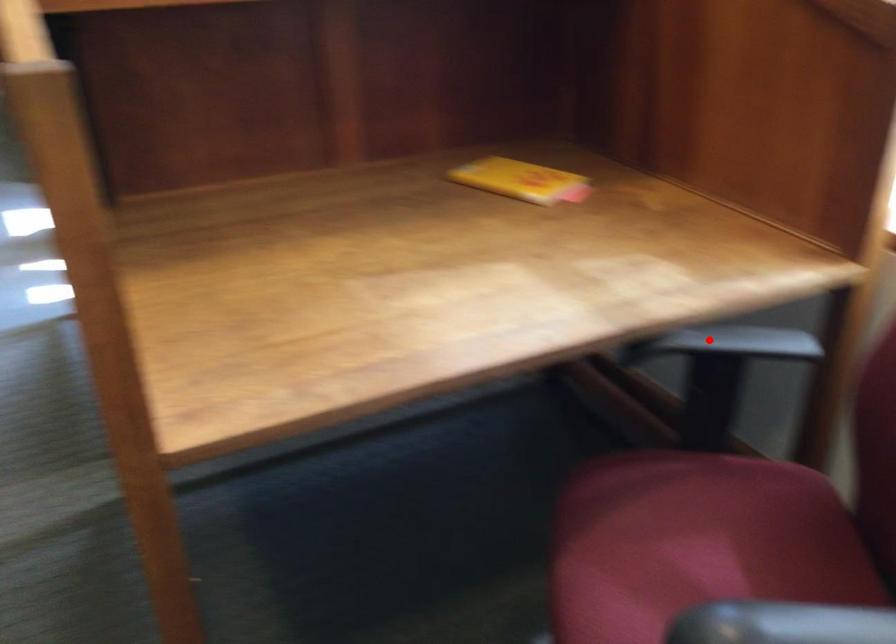
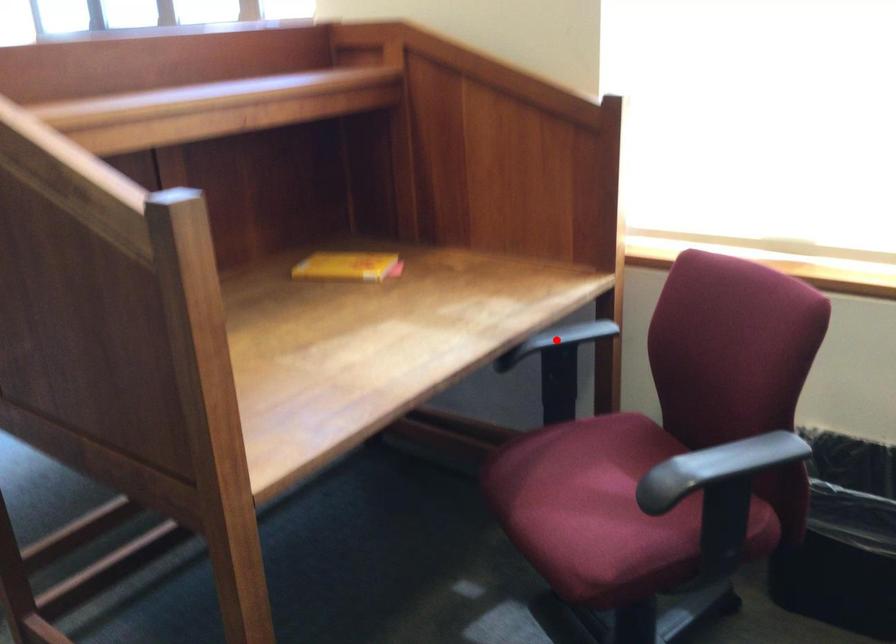
I am providing you with two images of the same scene from different viewpoints. A red point is marked on the first image and another point is marked on the second image. Are the points marked in image1 and image2 representing the same 3D position?

Yes